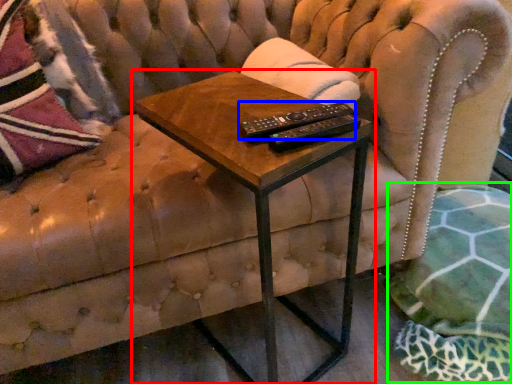
Question: Which is nearer to the table (highlighted by a red box)? control (highlighted by a blue box) or swivel chair (highlighted by a green box).

Choices:
 (A) control
 (B) swivel chair

Answer: (A)